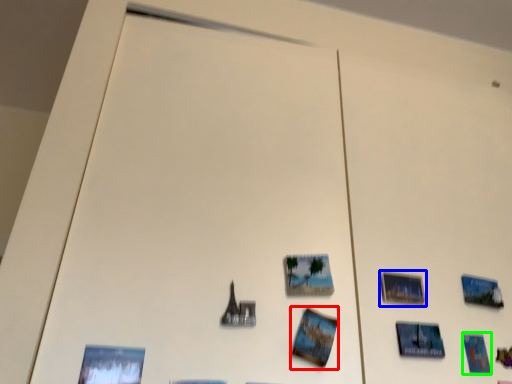
Question: Estimate the real-world distances between objects in this image. Which object is closer to postcard (highlighted by a red box), picture frame (highlighted by a blue box) or postcard (highlighted by a green box)?

Choices:
 (A) picture frame
 (B) postcard

Answer: (A)